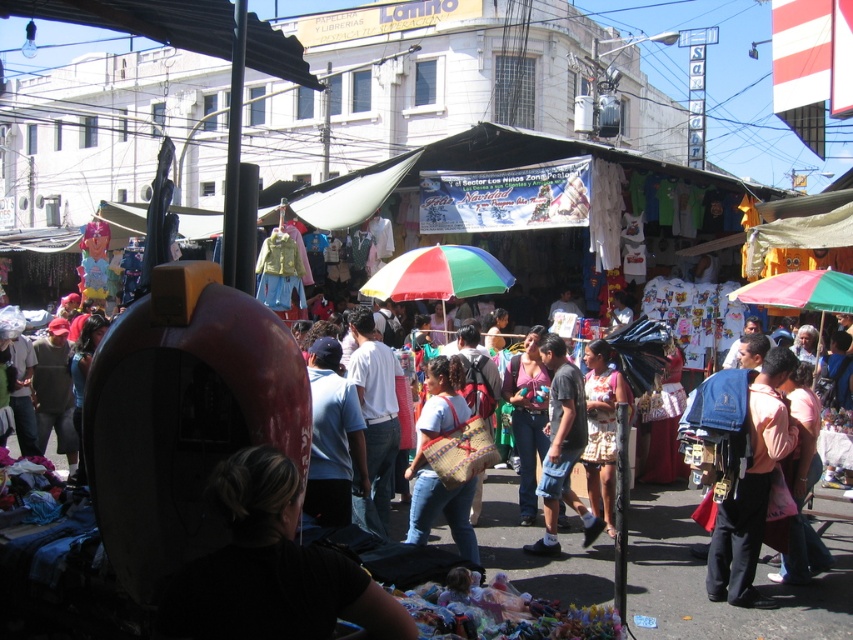
Question: Which is farther from the woven fabric bag at center?

Choices:
 (A) black fabric at lower center
 (B) printed cotton dress at center
 (C) light blue fabric shirt at center
 (D) rainbow fabric umbrella at center

Answer: (A)

Question: Considering the relative positions of pink fabric backpack at lower right and printed cotton dress at center in the image provided, where is pink fabric backpack at lower right located with respect to printed cotton dress at center?

Choices:
 (A) below
 (B) above

Answer: (A)

Question: Does black fabric at lower center appear on the right side of pink fabric backpack at lower right?

Choices:
 (A) no
 (B) yes

Answer: (A)

Question: Estimate the real-world distances between objects in this image. Which object is farther from the light blue denim shorts at center?

Choices:
 (A) printed cotton dress at center
 (B) pink fabric backpack at lower right
 (C) rainbow fabric umbrella at center

Answer: (C)

Question: Does light blue denim shorts at center have a larger size compared to printed cotton dress at center?

Choices:
 (A) no
 (B) yes

Answer: (B)

Question: Which object appears closest to the camera in this image?

Choices:
 (A) light blue denim shorts at center
 (B) printed cotton dress at center
 (C) woven fabric bag at center

Answer: (C)